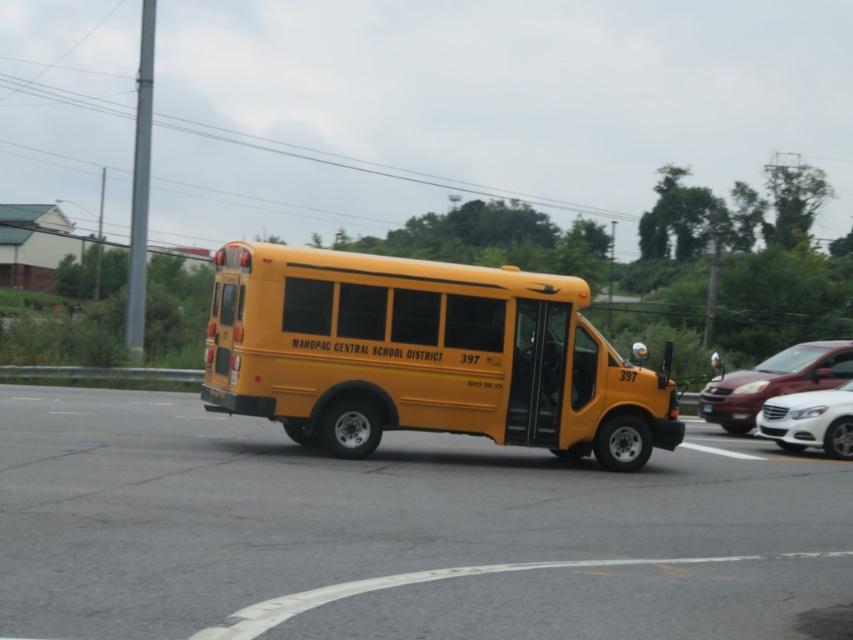
You are a delivery person who needs to load a tall package onto a vehicle. You see the yellow matte school bus at center and the matte white sedan at right. Which vehicle can accommodate the tall package without requiring adjustments?

The matte white sedan at right can accommodate the tall package without requiring adjustments because it has a greater height than the yellow matte school bus at center.

You are a delivery driver who needs to park your vehicle in a tight space between the matte white sedan at right and the white glossy sedan at center. Considering their heights, which vehicle should you position your truck closer to for better visibility while driving forward?

Since the matte white sedan at right is taller than the white glossy sedan at center, positioning your truck closer to the matte white sedan at right would provide better visibility as its height can help block less of your view compared to the shorter vehicle.